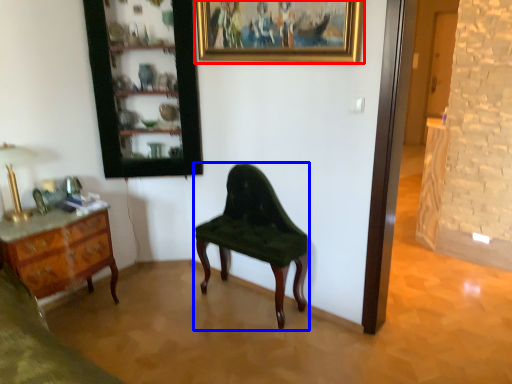
Question: Among these objects, which one is farthest to the camera, picture frame (highlighted by a red box) or chair (highlighted by a blue box)?

Choices:
 (A) picture frame
 (B) chair

Answer: (B)